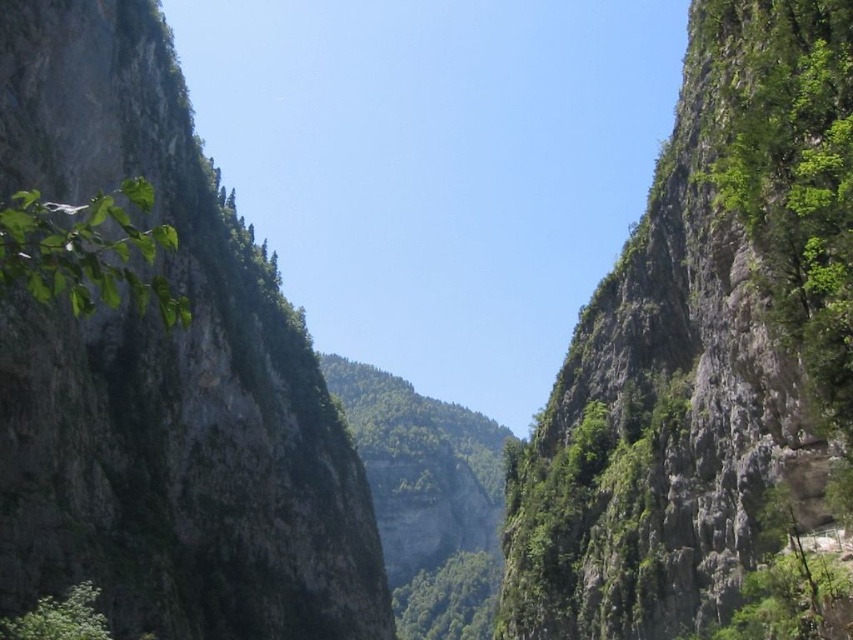
Question: Does green rocky cliff at center appear over green rough rock at left?

Choices:
 (A) yes
 (B) no

Answer: (A)

Question: Does green rocky cliff at center appear under green rough rock at left?

Choices:
 (A) no
 (B) yes

Answer: (A)

Question: Is green rocky cliff at center thinner than green rough rock at left?

Choices:
 (A) no
 (B) yes

Answer: (B)

Question: Which object appears farthest from the camera in this image?

Choices:
 (A) green rocky cliff at center
 (B) green rough rock at left

Answer: (B)